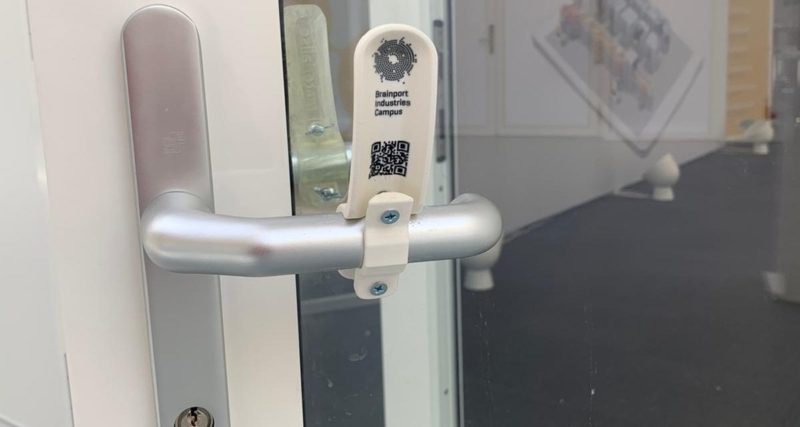
The height and width of the screenshot is (427, 800). I want to click on light, so click(490, 257), click(664, 173), click(761, 124).